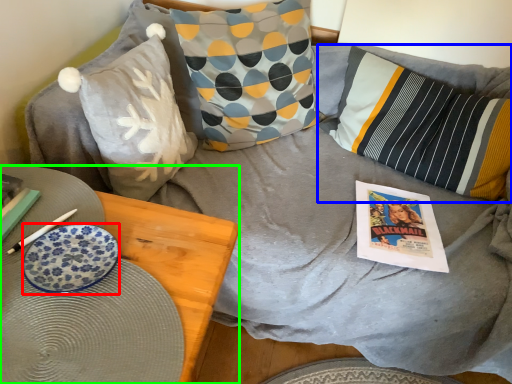
Question: Which object is positioned farthest from plate (highlighted by a red box)? Select from pillow (highlighted by a blue box) and furniture (highlighted by a green box).

Choices:
 (A) pillow
 (B) furniture

Answer: (A)